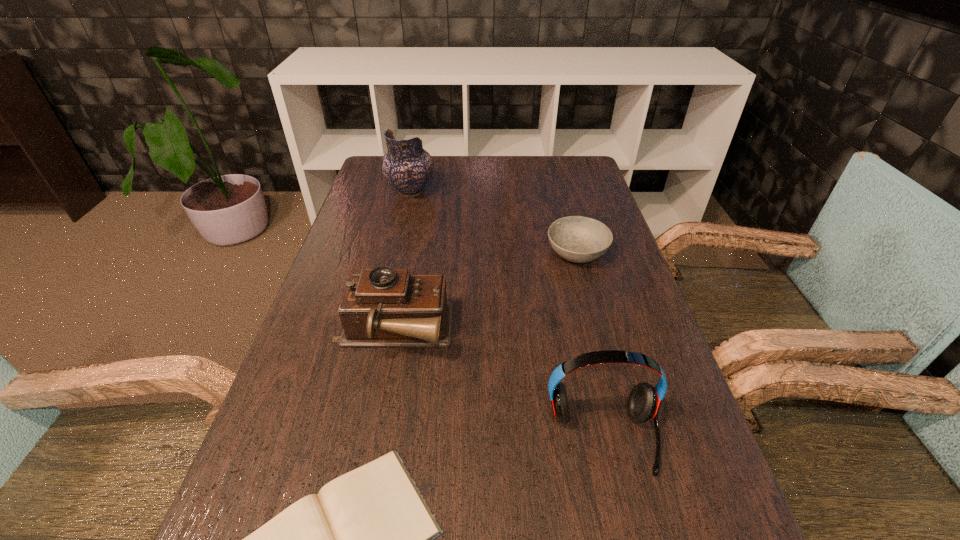
Find the location of a particular element. The height and width of the screenshot is (540, 960). object that is positioned at the far edge is located at coordinates (406, 166).

You are a GUI agent. You are given a task and a screenshot of the screen. Output one action in this format:
    pyautogui.click(x=<x>, y=<y>)
    Task: Click on the pottery present at the left edge
    
    Given the screenshot: What is the action you would take?
    pyautogui.click(x=406, y=166)

Where is `phonograph_record that is at the left edge`? The image size is (960, 540). phonograph_record that is at the left edge is located at coordinates [x=383, y=307].

The height and width of the screenshot is (540, 960). I want to click on headset that is at the right edge, so click(644, 400).

Identify the location of bowl that is positioned at the right edge. (578, 239).

Find the location of a particular element. This screenshot has width=960, height=540. object that is at the far left corner is located at coordinates (406, 166).

The width and height of the screenshot is (960, 540). Find the location of `free space at the far edge of the desktop`. free space at the far edge of the desktop is located at coordinates (512, 180).

Image resolution: width=960 pixels, height=540 pixels. Identify the location of free space at the left edge. (328, 432).

You are a GUI agent. You are given a task and a screenshot of the screen. Output one action in this format:
    pyautogui.click(x=<x>, y=<y>)
    Task: Click on the free spot at the right edge of the desktop
    
    Given the screenshot: What is the action you would take?
    pyautogui.click(x=587, y=196)

In the image, there is a desktop. Where is `blank space at the far right corner`? This screenshot has width=960, height=540. blank space at the far right corner is located at coordinates (553, 170).